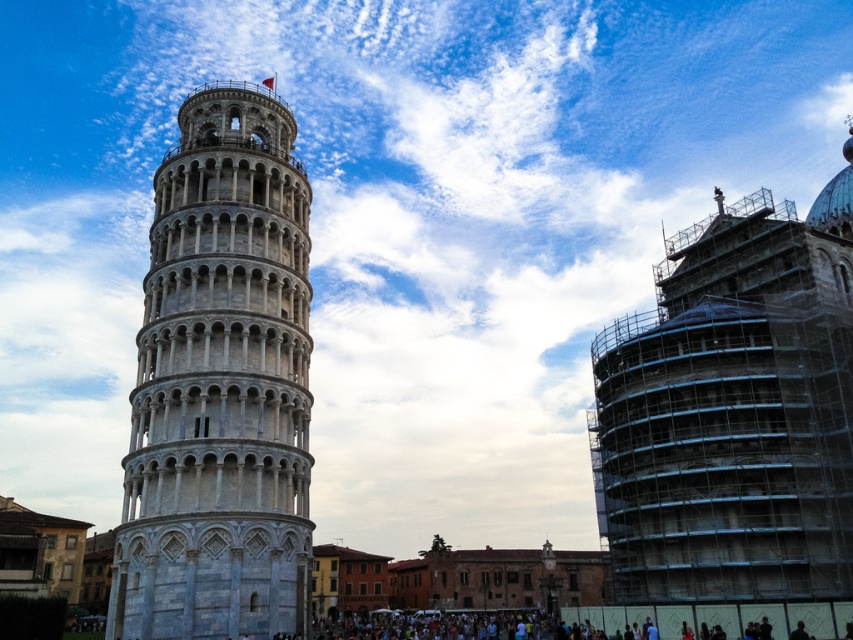
What are the coordinates of the gray stone tower at center in the image?

The gray stone tower at center is located at coordinates point [219,385].

In the scene shown: You are a photographer planning to capture a wide shot of the gray stone tower at center and the dark clothing crowd at lower center. Based on their sizes, which object should you focus on to ensure both fit comfortably in the frame?

The gray stone tower at center has a larger width than the dark clothing crowd at lower center, so focusing on the gray stone tower at center will ensure both fit comfortably in the frame.

You are standing in front of the gray stone tower at center and want to take a photo of it. If you move 10 meters closer to the tower, how far will you be from it?

→ The gray stone tower at center and camera are 42.20 meters apart. Moving 10 meters closer would reduce the distance to 32.20 meters.